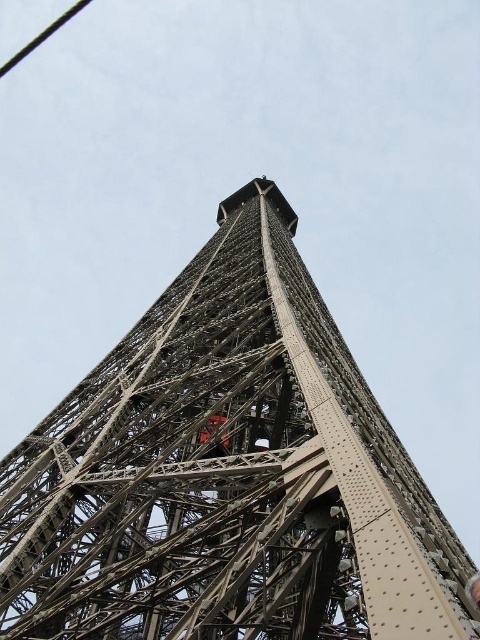
Question: Is metallic steel tower at center closer to the viewer compared to black wire at upper left?

Choices:
 (A) yes
 (B) no

Answer: (A)

Question: Is metallic steel tower at center bigger than black wire at upper left?

Choices:
 (A) no
 (B) yes

Answer: (B)

Question: Can you confirm if metallic steel tower at center is wider than black wire at upper left?

Choices:
 (A) no
 (B) yes

Answer: (B)

Question: Which object appears farthest from the camera in this image?

Choices:
 (A) black wire at upper left
 (B) metallic steel tower at center

Answer: (A)

Question: Which object appears farthest from the camera in this image?

Choices:
 (A) black wire at upper left
 (B) metallic steel tower at center

Answer: (A)